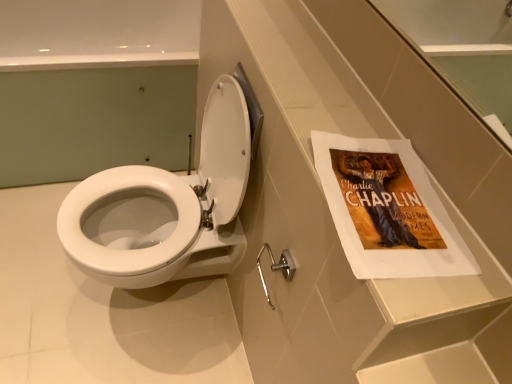
You are a GUI agent. You are given a task and a screenshot of the screen. Output one action in this format:
    pyautogui.click(x=<x>, y=<y>)
    Task: Click on the free space to the left of white glossy toilet at center
    
    Given the screenshot: What is the action you would take?
    pyautogui.click(x=36, y=266)